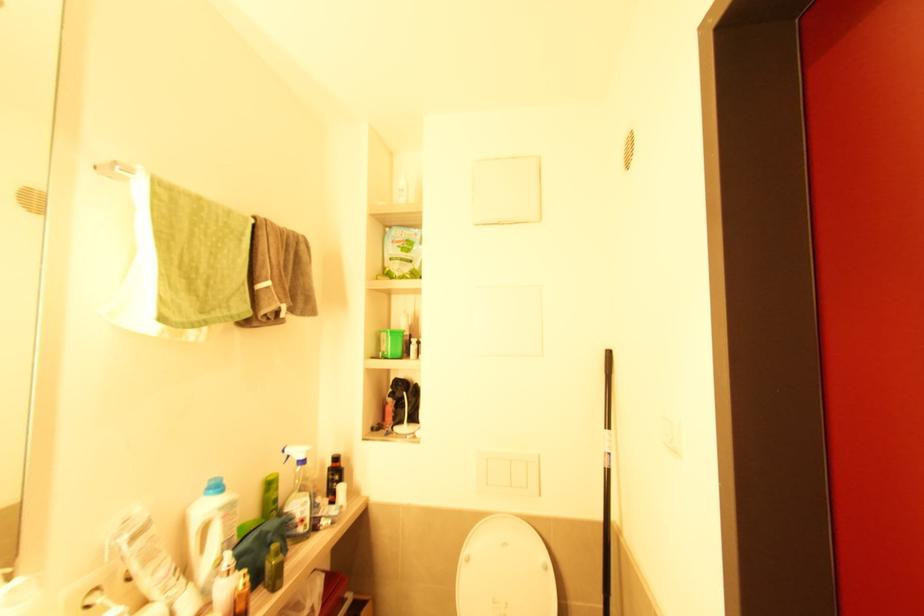
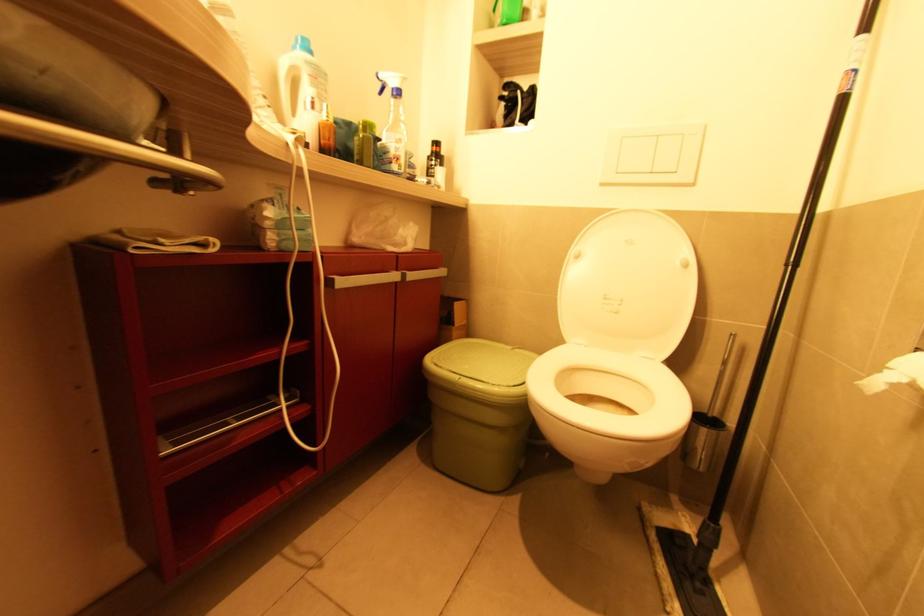
The images are taken continuously from a first-person perspective. In which direction is your viewpoint rotating?

The camera's rotation is toward left-down.